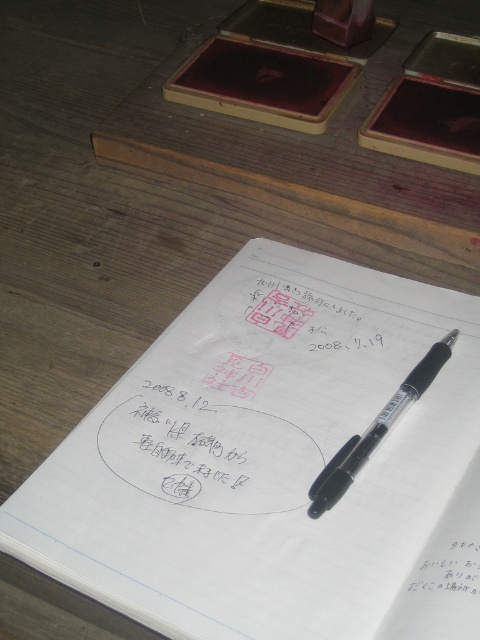
You are looking at the wooden desk and see two points marked on it. Which point is closer to you, point (245,445) or point (468,532)?

Point (245,445) is further to the camera than point (468,532). Wait, but the question asks which is closer to you. Since point (245,445) is further from the camera, it would be closer to the viewer if the camera is facing the desk. Hmm, maybe I need to clarify the coordinate system. In standard image coordinates, the origin is top left, so higher y is down. But the description says point A is further to the camera than point B. So in terms of depth, point A is closer to the viewer? Wait, the object